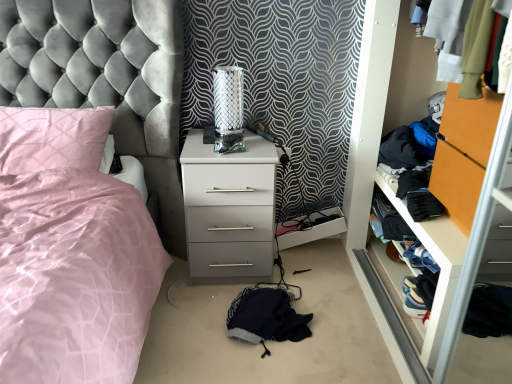
This screenshot has width=512, height=384. I want to click on vacant space to the right of white glossy chest of drawers at center, so click(315, 278).